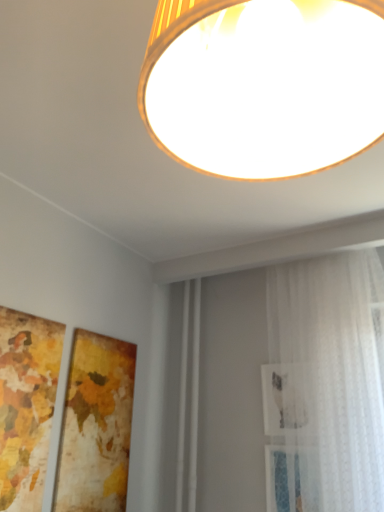
Measure the distance between matte gold lampshade at upper center and camera.

The distance of matte gold lampshade at upper center from camera is 11.67 inches.

The height and width of the screenshot is (512, 384). What do you see at coordinates (264, 84) in the screenshot? I see `matte gold lampshade at upper center` at bounding box center [264, 84].

This screenshot has height=512, width=384. Identify the location of white sheer curtain at right. (324, 385).

The width and height of the screenshot is (384, 512). I want to click on wooden textured frame at lower left, which ranks as the first picture frame in right-to-left order, so click(96, 425).

What are the coordinates of `matte gold lampshade at upper center` in the screenshot? It's located at (264, 84).

Is wooden map at left, the 1th picture frame viewed from the left, completely or partially outside of matte gold lampshade at upper center?

Absolutely, wooden map at left, the 1th picture frame viewed from the left, is external to matte gold lampshade at upper center.

From a real-world perspective, count 1st picture frames downward from the matte gold lampshade at upper center and point to it. Please provide its 2D coordinates.

[(26, 405)]

Is there a large distance between wooden map at left, the 1th picture frame viewed from the left, and matte gold lampshade at upper center?

Yes, wooden map at left, the 1th picture frame viewed from the left, is far from matte gold lampshade at upper center.

Does point (95, 414) appear closer or farther from the camera than point (304, 398)?

Point (95, 414) is farther from the camera than point (304, 398).

Is wooden textured frame at lower left, the second picture frame positioned from the left, smaller than white sheer curtain at right?

Correct, wooden textured frame at lower left, the second picture frame positioned from the left, occupies less space than white sheer curtain at right.

How distant is wooden map at left, the 1th picture frame viewed from the left, from wooden textured frame at lower left, which ranks as the first picture frame in right-to-left order?

A distance of 9.22 inches exists between wooden map at left, the 1th picture frame viewed from the left, and wooden textured frame at lower left, which ranks as the first picture frame in right-to-left order.

From a real-world perspective, which is physically below, wooden map at left, which ranks as the second picture frame in right-to-left order, or wooden textured frame at lower left, which ranks as the first picture frame in right-to-left order?

From a 3D spatial view, wooden textured frame at lower left, which ranks as the first picture frame in right-to-left order, is below.

Identify the location of picture frame on the left of wooden textured frame at lower left, which ranks as the first picture frame in right-to-left order. (26, 405).

From the image's perspective, is wooden map at left, which ranks as the second picture frame in right-to-left order, below wooden textured frame at lower left, which ranks as the first picture frame in right-to-left order?

No, from the image's perspective, wooden map at left, which ranks as the second picture frame in right-to-left order, is not below wooden textured frame at lower left, which ranks as the first picture frame in right-to-left order.

Between wooden map at left, the 1th picture frame viewed from the left, and white sheer curtain at right, which one has smaller size?

With smaller size is wooden map at left, the 1th picture frame viewed from the left.

Which is closer to the camera, (41, 474) or (322, 309)?

Point (41, 474) is closer to the camera than point (322, 309).

From a real-world perspective, is wooden map at left, the 1th picture frame viewed from the left, under white sheer curtain at right?

Indeed, from a real-world perspective, wooden map at left, the 1th picture frame viewed from the left, is positioned beneath white sheer curtain at right.

Based on the photo, is wooden map at left, the 1th picture frame viewed from the left, with white sheer curtain at right?

No.

From a real-world perspective, is white sheer curtain at right over wooden map at left, which ranks as the second picture frame in right-to-left order?

Yes, from a real-world perspective, white sheer curtain at right is on top of wooden map at left, which ranks as the second picture frame in right-to-left order.

Can you confirm if white sheer curtain at right is positioned to the right of wooden map at left, which ranks as the second picture frame in right-to-left order?

Indeed, white sheer curtain at right is positioned on the right side of wooden map at left, which ranks as the second picture frame in right-to-left order.

Which of these two, white sheer curtain at right or wooden map at left, which ranks as the second picture frame in right-to-left order, stands shorter?

wooden map at left, which ranks as the second picture frame in right-to-left order.

From the image's perspective, is white sheer curtain at right above wooden map at left, which ranks as the second picture frame in right-to-left order?

No, from the image's perspective, white sheer curtain at right is not over wooden map at left, which ranks as the second picture frame in right-to-left order.

Is matte gold lampshade at upper center facing away from white sheer curtain at right?

Yes, matte gold lampshade at upper center is positioned with its back facing white sheer curtain at right.

From the picture: What's the angular difference between matte gold lampshade at upper center and white sheer curtain at right's facing directions?

0.167 degrees.

Does matte gold lampshade at upper center have a greater height compared to white sheer curtain at right?

No.

Which object is more forward, matte gold lampshade at upper center or white sheer curtain at right?

matte gold lampshade at upper center.

Considering the relative positions of wooden textured frame at lower left, which ranks as the first picture frame in right-to-left order, and matte gold lampshade at upper center in the image provided, is wooden textured frame at lower left, which ranks as the first picture frame in right-to-left order, to the left of matte gold lampshade at upper center from the viewer's perspective?

Yes, wooden textured frame at lower left, which ranks as the first picture frame in right-to-left order, is to the left of matte gold lampshade at upper center.

Measure the distance between wooden textured frame at lower left, which ranks as the first picture frame in right-to-left order, and matte gold lampshade at upper center.

A distance of 1.56 meters exists between wooden textured frame at lower left, which ranks as the first picture frame in right-to-left order, and matte gold lampshade at upper center.

Can you confirm if wooden textured frame at lower left, the second picture frame positioned from the left, is shorter than matte gold lampshade at upper center?

Incorrect, the height of wooden textured frame at lower left, the second picture frame positioned from the left, does not fall short of that of matte gold lampshade at upper center.

From a real-world perspective, is wooden textured frame at lower left, which ranks as the first picture frame in right-to-left order, above or below matte gold lampshade at upper center?

wooden textured frame at lower left, which ranks as the first picture frame in right-to-left order, is below matte gold lampshade at upper center.

This screenshot has height=512, width=384. Identify the location of lamp to the right of wooden map at left, which ranks as the second picture frame in right-to-left order. point(264,84).

Locate an element on the screen. picture frame that is behind the white sheer curtain at right is located at coordinates (96, 425).

From the picture: Estimate the real-world distances between objects in this image. Which object is further from matte gold lampshade at upper center, wooden map at left, the 1th picture frame viewed from the left, or white sheer curtain at right?

Among the two, white sheer curtain at right is located further to matte gold lampshade at upper center.

Based on their spatial positions, is white sheer curtain at right or wooden textured frame at lower left, the second picture frame positioned from the left, further from wooden map at left, which ranks as the second picture frame in right-to-left order?

The object further to wooden map at left, which ranks as the second picture frame in right-to-left order, is white sheer curtain at right.

Based on their spatial positions, is matte gold lampshade at upper center or white sheer curtain at right closer to wooden textured frame at lower left, which ranks as the first picture frame in right-to-left order?

Among the two, white sheer curtain at right is located nearer to wooden textured frame at lower left, which ranks as the first picture frame in right-to-left order.

Considering their positions, is wooden textured frame at lower left, which ranks as the first picture frame in right-to-left order, positioned further to matte gold lampshade at upper center than white sheer curtain at right?

Among the two, wooden textured frame at lower left, which ranks as the first picture frame in right-to-left order, is located further to matte gold lampshade at upper center.

Looking at the image, which one is located closer to wooden textured frame at lower left, which ranks as the first picture frame in right-to-left order, wooden map at left, which ranks as the second picture frame in right-to-left order, or matte gold lampshade at upper center?

Among the two, wooden map at left, which ranks as the second picture frame in right-to-left order, is located nearer to wooden textured frame at lower left, which ranks as the first picture frame in right-to-left order.

When comparing their distances from wooden map at left, which ranks as the second picture frame in right-to-left order, does matte gold lampshade at upper center or wooden textured frame at lower left, which ranks as the first picture frame in right-to-left order, seem further?

The object further to wooden map at left, which ranks as the second picture frame in right-to-left order, is matte gold lampshade at upper center.

When comparing their distances from wooden textured frame at lower left, which ranks as the first picture frame in right-to-left order, does matte gold lampshade at upper center or wooden map at left, the 1th picture frame viewed from the left, seem further?

The object further to wooden textured frame at lower left, which ranks as the first picture frame in right-to-left order, is matte gold lampshade at upper center.

From the image, which object appears to be nearer to wooden map at left, the 1th picture frame viewed from the left, white sheer curtain at right or matte gold lampshade at upper center?

Based on the image, white sheer curtain at right appears to be nearer to wooden map at left, the 1th picture frame viewed from the left.

The height and width of the screenshot is (512, 384). I want to click on picture frame situated between wooden map at left, the 1th picture frame viewed from the left, and white sheer curtain at right from left to right, so click(96, 425).

Where is `picture frame located between matte gold lampshade at upper center and wooden textured frame at lower left, which ranks as the first picture frame in right-to-left order, in the depth direction`? This screenshot has width=384, height=512. picture frame located between matte gold lampshade at upper center and wooden textured frame at lower left, which ranks as the first picture frame in right-to-left order, in the depth direction is located at coordinates (26, 405).

I want to click on picture frame between matte gold lampshade at upper center and white sheer curtain at right in the front-back direction, so click(x=26, y=405).

Where is `curtain between matte gold lampshade at upper center and wooden textured frame at lower left, which ranks as the first picture frame in right-to-left order, along the z-axis`? The width and height of the screenshot is (384, 512). curtain between matte gold lampshade at upper center and wooden textured frame at lower left, which ranks as the first picture frame in right-to-left order, along the z-axis is located at coordinates (324, 385).